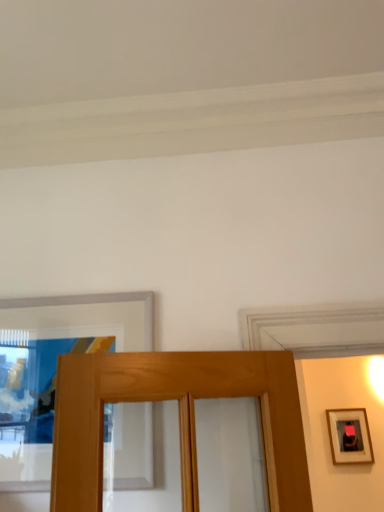
The image size is (384, 512). What are the coordinates of `wooden framed mirror at right, acting as the 1th picture frame starting from the back` in the screenshot? It's located at (349, 436).

Describe the element at coordinates (349, 436) in the screenshot. The image size is (384, 512). I see `wooden framed mirror at right, which appears as the second picture frame when viewed from the top` at that location.

The image size is (384, 512). I want to click on wooden picture frame at upper left, the first picture frame positioned from the front, so click(x=53, y=375).

In order to face wooden picture frame at upper left, which is the second picture frame in right-to-left order, should I rotate leftwards or rightwards?

Rotate your view left by about 16.193°.

What do you see at coordinates (53, 375) in the screenshot? This screenshot has width=384, height=512. I see `wooden picture frame at upper left, the first picture frame positioned from the front` at bounding box center [53, 375].

The width and height of the screenshot is (384, 512). Find the location of `wooden framed mirror at right, which is counted as the 1th picture frame, starting from the right`. wooden framed mirror at right, which is counted as the 1th picture frame, starting from the right is located at coordinates (349, 436).

Considering the positions of objects wooden picture frame at upper left, which is the 1th picture frame from left to right, and wooden framed mirror at right, the 2th picture frame viewed from the front, in the image provided, who is more to the left, wooden picture frame at upper left, which is the 1th picture frame from left to right, or wooden framed mirror at right, the 2th picture frame viewed from the front,?

wooden picture frame at upper left, which is the 1th picture frame from left to right, is more to the left.

Considering the positions of objects wooden picture frame at upper left, which appears as the 2th picture frame when viewed from the back, and wooden framed mirror at right, the 2th picture frame viewed from the front, in the image provided, who is behind, wooden picture frame at upper left, which appears as the 2th picture frame when viewed from the back, or wooden framed mirror at right, the 2th picture frame viewed from the front,?

Positioned behind is wooden framed mirror at right, the 2th picture frame viewed from the front.

Which is further, (39, 438) or (350, 437)?

The point (350, 437) is more distant.

From the image's perspective, is wooden picture frame at upper left, the 1th picture frame from the top, located above wooden framed mirror at right, which is counted as the 1th picture frame, starting from the right?

Yes, from the image's perspective, wooden picture frame at upper left, the 1th picture frame from the top, is above wooden framed mirror at right, which is counted as the 1th picture frame, starting from the right.

From a real-world perspective, who is located higher, wooden picture frame at upper left, the 2th picture frame from the bottom, or wooden framed mirror at right, placed as the 2th picture frame when sorted from left to right?

In real-world perspective, wooden picture frame at upper left, the 2th picture frame from the bottom, is above.

Which object is wider, wooden picture frame at upper left, the first picture frame positioned from the front, or wooden framed mirror at right, which is counted as the 1th picture frame, starting from the right?

wooden picture frame at upper left, the first picture frame positioned from the front, is wider.

Considering the sizes of objects wooden picture frame at upper left, the 1th picture frame from the top, and wooden framed mirror at right, placed as the 2th picture frame when sorted from left to right, in the image provided, who is shorter, wooden picture frame at upper left, the 1th picture frame from the top, or wooden framed mirror at right, placed as the 2th picture frame when sorted from left to right,?

wooden framed mirror at right, placed as the 2th picture frame when sorted from left to right, is shorter.

Is wooden picture frame at upper left, which is the second picture frame in right-to-left order, bigger than wooden framed mirror at right, acting as the 1th picture frame starting from the bottom?

Yes.

Is wooden picture frame at upper left, which appears as the 2th picture frame when viewed from the back, completely or partially outside of wooden framed mirror at right, which is counted as the 1th picture frame, starting from the right?

Yes, wooden picture frame at upper left, which appears as the 2th picture frame when viewed from the back, is not within wooden framed mirror at right, which is counted as the 1th picture frame, starting from the right.

Is the surface of wooden picture frame at upper left, which appears as the 2th picture frame when viewed from the back, in direct contact with wooden framed mirror at right, which is counted as the 1th picture frame, starting from the right?

They are not placed beside each other.

Is wooden picture frame at upper left, which is the second picture frame in right-to-left order, aimed at wooden framed mirror at right, acting as the 1th picture frame starting from the back?

No, wooden picture frame at upper left, which is the second picture frame in right-to-left order, is not turned towards wooden framed mirror at right, acting as the 1th picture frame starting from the back.

How much distance is there between wooden picture frame at upper left, which appears as the 2th picture frame when viewed from the back, and wooden framed mirror at right, acting as the 1th picture frame starting from the bottom?

They are 2.72 meters apart.

Image resolution: width=384 pixels, height=512 pixels. Identify the location of picture frame directly beneath the wooden picture frame at upper left, the 1th picture frame from the top (from a real-world perspective). (349, 436).

Considering the positions of objects wooden framed mirror at right, acting as the 1th picture frame starting from the back, and wooden picture frame at upper left, the 2th picture frame from the bottom, in the image provided, who is more to the left, wooden framed mirror at right, acting as the 1th picture frame starting from the back, or wooden picture frame at upper left, the 2th picture frame from the bottom,?

wooden picture frame at upper left, the 2th picture frame from the bottom, is more to the left.

Is wooden framed mirror at right, the 2th picture frame viewed from the front, in front of or behind wooden picture frame at upper left, the 2th picture frame from the bottom, in the image?

wooden framed mirror at right, the 2th picture frame viewed from the front, is behind wooden picture frame at upper left, the 2th picture frame from the bottom.

Is point (362, 455) less distant than point (30, 320)?

That is False.

From the image's perspective, between wooden framed mirror at right, acting as the 1th picture frame starting from the back, and wooden picture frame at upper left, the 1th picture frame from the top, which one is located above?

From the image's view, wooden picture frame at upper left, the 1th picture frame from the top, is above.

From a real-world perspective, is wooden framed mirror at right, the 2th picture frame viewed from the front, positioned above or below wooden picture frame at upper left, which is the 1th picture frame from left to right?

wooden framed mirror at right, the 2th picture frame viewed from the front, is below wooden picture frame at upper left, which is the 1th picture frame from left to right.

Looking at their sizes, would you say wooden framed mirror at right, the 2th picture frame viewed from the front, is wider or thinner than wooden picture frame at upper left, the first picture frame positioned from the front?

wooden framed mirror at right, the 2th picture frame viewed from the front, is thinner than wooden picture frame at upper left, the first picture frame positioned from the front.

Does wooden framed mirror at right, acting as the 1th picture frame starting from the back, have a greater height compared to wooden picture frame at upper left, the 2th picture frame from the bottom?

No.

Considering the sizes of wooden framed mirror at right, which is counted as the 1th picture frame, starting from the right, and wooden picture frame at upper left, the first picture frame positioned from the front, in the image, is wooden framed mirror at right, which is counted as the 1th picture frame, starting from the right, bigger or smaller than wooden picture frame at upper left, the first picture frame positioned from the front,?

wooden framed mirror at right, which is counted as the 1th picture frame, starting from the right, is smaller than wooden picture frame at upper left, the first picture frame positioned from the front.

Is wooden framed mirror at right, the 2th picture frame viewed from the front, positioned beyond the bounds of wooden picture frame at upper left, which appears as the 2th picture frame when viewed from the back?

wooden framed mirror at right, the 2th picture frame viewed from the front, lies outside wooden picture frame at upper left, which appears as the 2th picture frame when viewed from the back,'s area.

Can you see wooden framed mirror at right, which is counted as the 1th picture frame, starting from the right, touching wooden picture frame at upper left, which is the second picture frame in right-to-left order?

wooden framed mirror at right, which is counted as the 1th picture frame, starting from the right, is not next to wooden picture frame at upper left, which is the second picture frame in right-to-left order, and they're not touching.

Is wooden framed mirror at right, the 2th picture frame viewed from the front, looking in the opposite direction of wooden picture frame at upper left, the first picture frame positioned from the front?

wooden framed mirror at right, the 2th picture frame viewed from the front, is not turned away from wooden picture frame at upper left, the first picture frame positioned from the front.

I want to click on picture frame above the wooden framed mirror at right, placed as the 2th picture frame when sorted from left to right (from the image's perspective), so click(53, 375).

Identify the location of picture frame in front of the wooden framed mirror at right, the 2th picture frame viewed from the front. This screenshot has height=512, width=384. (53, 375).

In the image, there is a wooden picture frame at upper left, the 1th picture frame from the top. What are the coordinates of `picture frame below it (from the image's perspective)` in the screenshot? It's located at [x=349, y=436].